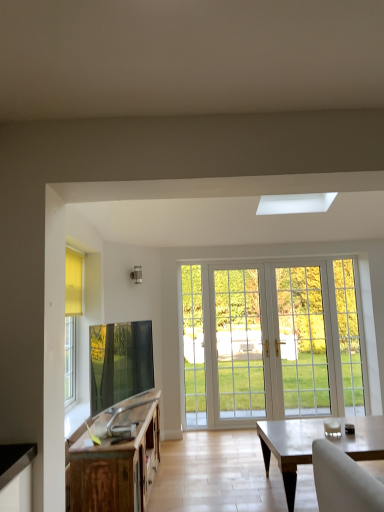
Question: Is matte wooden coffee table at lower right in front of or behind wooden cabinet at lower left in the image?

Choices:
 (A) behind
 (B) front

Answer: (A)

Question: Would you say matte wooden coffee table at lower right is to the left or to the right of wooden cabinet at lower left in the picture?

Choices:
 (A) right
 (B) left

Answer: (A)

Question: From a real-world perspective, is matte wooden coffee table at lower right positioned above or below wooden cabinet at lower left?

Choices:
 (A) below
 (B) above

Answer: (A)

Question: From the image's perspective, is wooden cabinet at lower left located above or below matte wooden coffee table at lower right?

Choices:
 (A) below
 (B) above

Answer: (B)

Question: Considering the positions of wooden cabinet at lower left and matte wooden coffee table at lower right in the image, is wooden cabinet at lower left taller or shorter than matte wooden coffee table at lower right?

Choices:
 (A) short
 (B) tall

Answer: (B)

Question: Would you say wooden cabinet at lower left is to the left or to the right of matte wooden coffee table at lower right in the picture?

Choices:
 (A) left
 (B) right

Answer: (A)

Question: Looking at their shapes, would you say wooden cabinet at lower left is wider or thinner than matte wooden coffee table at lower right?

Choices:
 (A) thin
 (B) wide

Answer: (A)